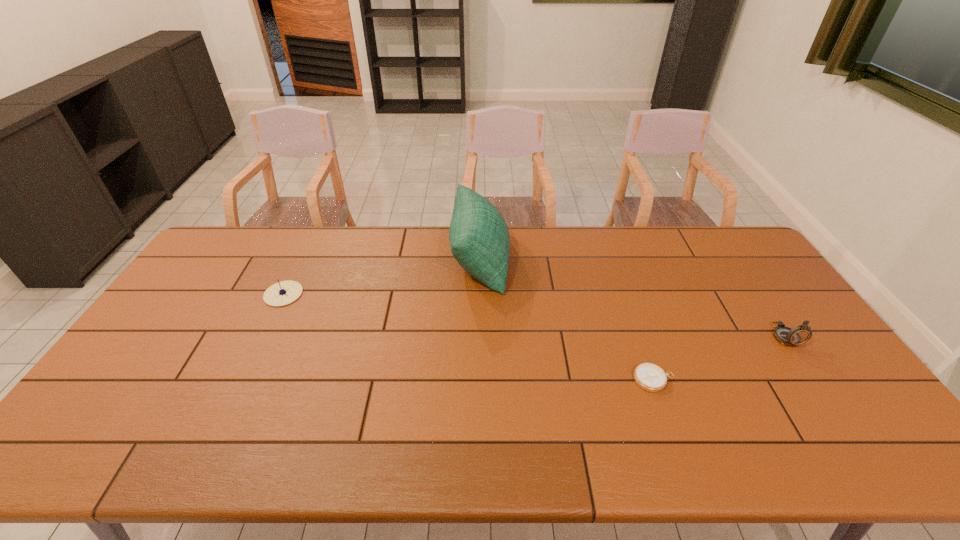
In order to click on object that can be found as the second closest to the tallest object in this screenshot , I will do `click(282, 293)`.

Identify which compass is located as the nearest to the cushion. Please provide its 2D coordinates. Your answer should be formatted as a tuple, i.e. [(x, y)], where the tuple contains the x and y coordinates of a point satisfying the conditions above.

[(650, 377)]

Locate which compass is the second closest to the second tallest compass. Please provide its 2D coordinates. Your answer should be formatted as a tuple, i.e. [(x, y)], where the tuple contains the x and y coordinates of a point satisfying the conditions above.

[(800, 334)]

Find the location of a particular element. This screenshot has width=960, height=540. free location that satisfies the following two spatial constraints: 1. on the front-facing side of the cushion; 2. on the front side of the second shortest object is located at coordinates (480, 294).

The height and width of the screenshot is (540, 960). What are the coordinates of `vacant space that satisfies the following two spatial constraints: 1. on the front-facing side of the cushion; 2. on the back side of the shortest compass` in the screenshot? It's located at [x=480, y=380].

I want to click on vacant region that satisfies the following two spatial constraints: 1. on the front-facing side of the tallest object; 2. on the back side of the second compass from left to right, so click(x=480, y=380).

At what (x,y) coordinates should I click in order to perform the action: click on vacant space that satisfies the following two spatial constraints: 1. on the front-facing side of the third object from right to left; 2. on the front side of the farthest compass. Please return your answer as a coordinate pair (x, y). The height and width of the screenshot is (540, 960). Looking at the image, I should click on (480, 294).

I want to click on vacant space that satisfies the following two spatial constraints: 1. on the front-facing side of the tallest object; 2. on the back side of the second compass from left to right, so click(x=480, y=380).